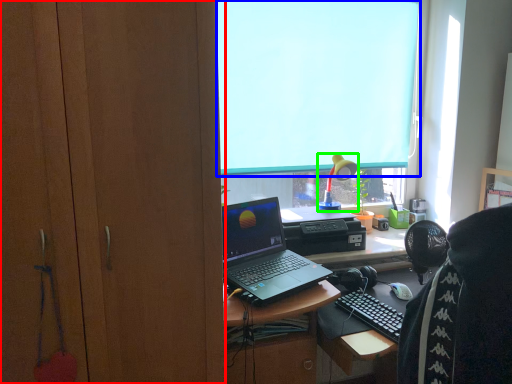
Question: Which object is the closest to the cabinetry (highlighted by a red box)? Choose among these: window screen (highlighted by a blue box) or lamp (highlighted by a green box).

Choices:
 (A) window screen
 (B) lamp

Answer: (A)